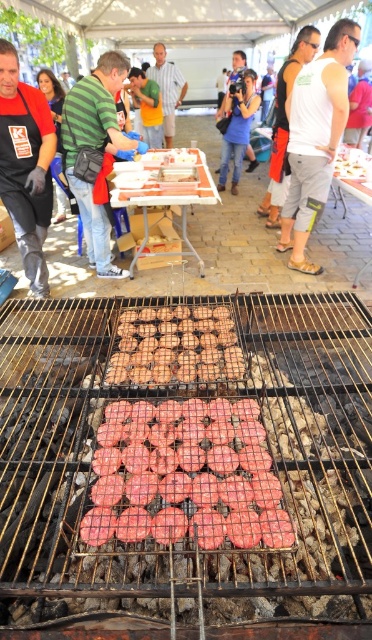
Which is below, white matte tank top at center or white glossy plate at center?

white glossy plate at center is lower down.

Can you confirm if white matte tank top at center is wider than white glossy plate at center?

Incorrect, white matte tank top at center's width does not surpass white glossy plate at center's.

What do you see at coordinates (284, 124) in the screenshot?
I see `white matte tank top at center` at bounding box center [284, 124].

Locate an element on the screen. The image size is (372, 640). white matte tank top at center is located at coordinates (284, 124).

Does white matte tank top at center have a smaller size compared to light brown shirt at center?

Incorrect, white matte tank top at center is not smaller in size than light brown shirt at center.

Who is higher up, white matte tank top at center or light brown shirt at center?

light brown shirt at center is above.

I want to click on white matte tank top at center, so click(284, 124).

Does pink rubber rings at center have a greater height compared to green striped shirt at center?

No.

Image resolution: width=372 pixels, height=640 pixels. What do you see at coordinates (186, 476) in the screenshot?
I see `pink rubber rings at center` at bounding box center [186, 476].

Does point (264, 515) lie in front of point (142, 99)?

Yes, point (264, 515) is in front of point (142, 99).

The width and height of the screenshot is (372, 640). Find the location of `pink rubber rings at center`. pink rubber rings at center is located at coordinates point(186,476).